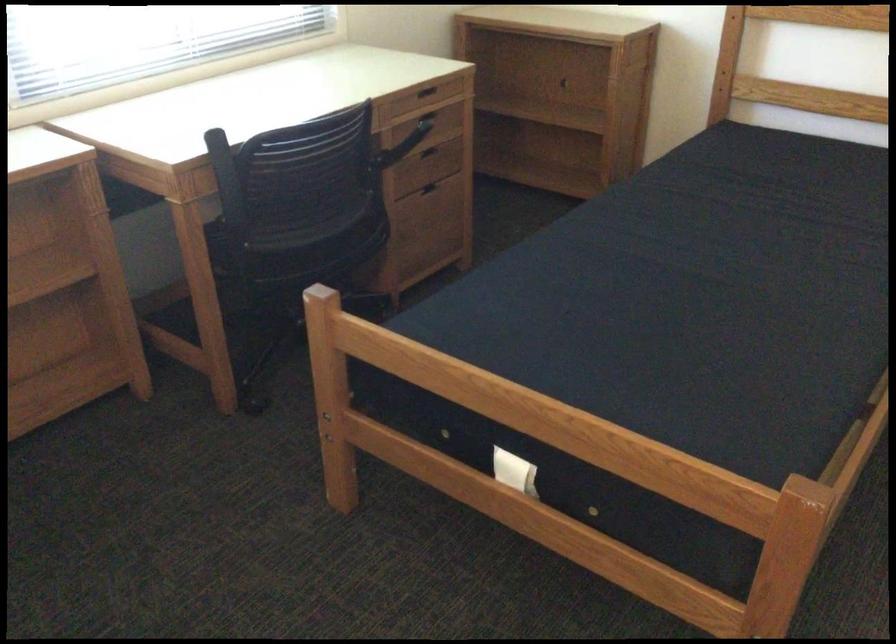
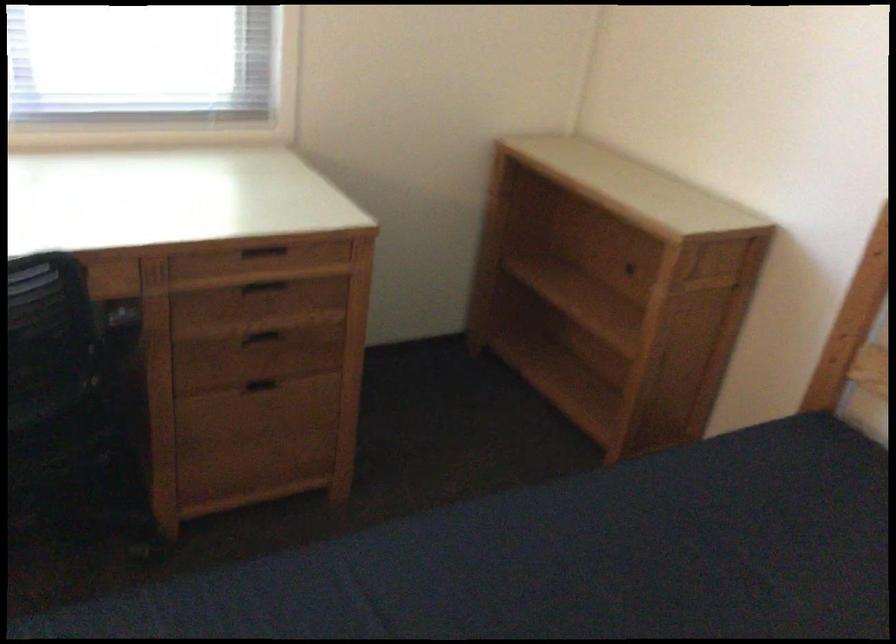
Where in the second image is the point corresponding to (408,161) from the first image?

(264, 333)